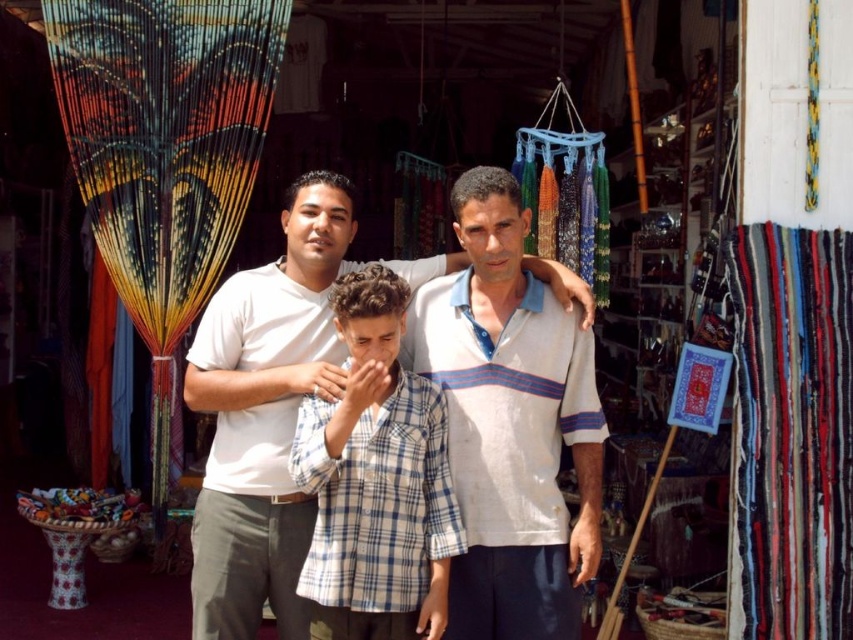
Question: Where is white striped polo shirt at center located in relation to white striped shirt at center in the image?

Choices:
 (A) left
 (B) right

Answer: (B)

Question: From the image, what is the correct spatial relationship of white striped shirt at center in relation to blue plaid shirt at center?

Choices:
 (A) below
 (B) above

Answer: (B)

Question: Does white striped polo shirt at center appear under blue plaid shirt at center?

Choices:
 (A) yes
 (B) no

Answer: (B)

Question: Which point appears closest to the camera in this image?

Choices:
 (A) (363, 566)
 (B) (241, 531)

Answer: (A)

Question: Which point is closer to the camera taking this photo?

Choices:
 (A) (461, 532)
 (B) (496, 330)

Answer: (A)

Question: Which point appears farthest from the camera in this image?

Choices:
 (A) (527, 339)
 (B) (322, 458)
 (C) (329, 173)

Answer: (C)